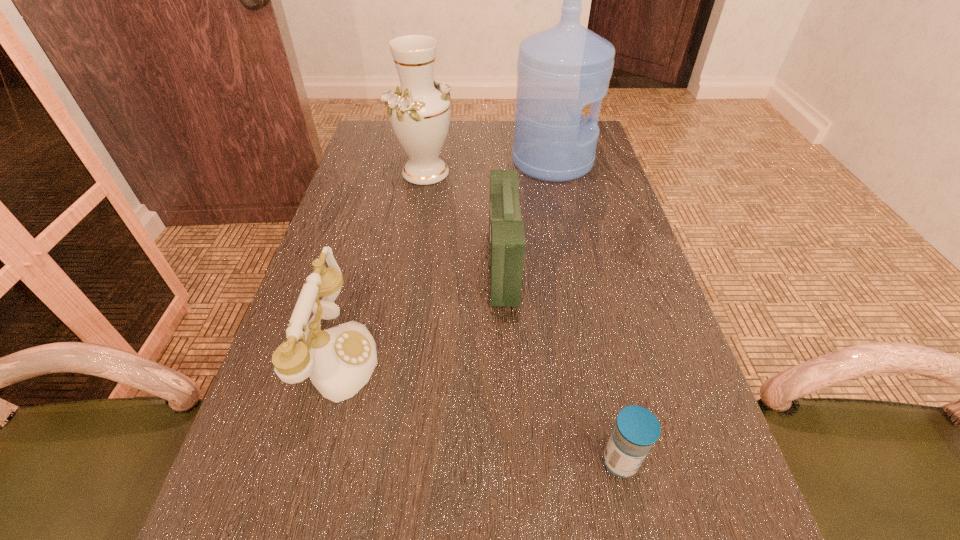
What are the coordinates of `free location at the far edge` in the screenshot? It's located at coord(447,156).

In the image, there is a desktop. Where is `vacant space at the left edge`? This screenshot has height=540, width=960. vacant space at the left edge is located at coordinates (372, 252).

This screenshot has height=540, width=960. I want to click on blank space at the right edge, so click(655, 294).

The width and height of the screenshot is (960, 540). I want to click on vacant space at the far left corner of the desktop, so click(x=383, y=130).

This screenshot has width=960, height=540. Identify the location of empty location between the telephone and the second tallest object. (382, 264).

Locate an element on the screen. The width and height of the screenshot is (960, 540). vacant area between the medicine and the first-aid kit is located at coordinates (562, 363).

This screenshot has height=540, width=960. I want to click on unoccupied position between the third object from left to right and the telephone, so (x=420, y=310).

You are a GUI agent. You are given a task and a screenshot of the screen. Output one action in this format:
    pyautogui.click(x=<x>, y=<y>)
    Task: Click on the vacant area between the shortest object and the first-aid kit
    The height and width of the screenshot is (540, 960).
    Given the screenshot: What is the action you would take?
    pyautogui.click(x=562, y=363)

Where is `unoccupied position between the first-aid kit and the tallest object`? The width and height of the screenshot is (960, 540). unoccupied position between the first-aid kit and the tallest object is located at coordinates (528, 214).

The image size is (960, 540). I want to click on free point between the first-aid kit and the water jug, so click(528, 214).